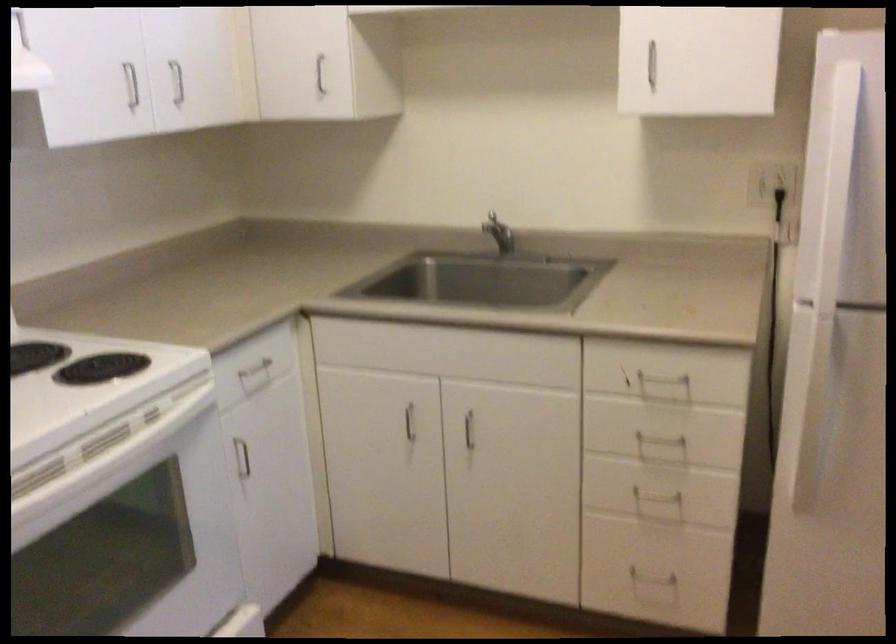
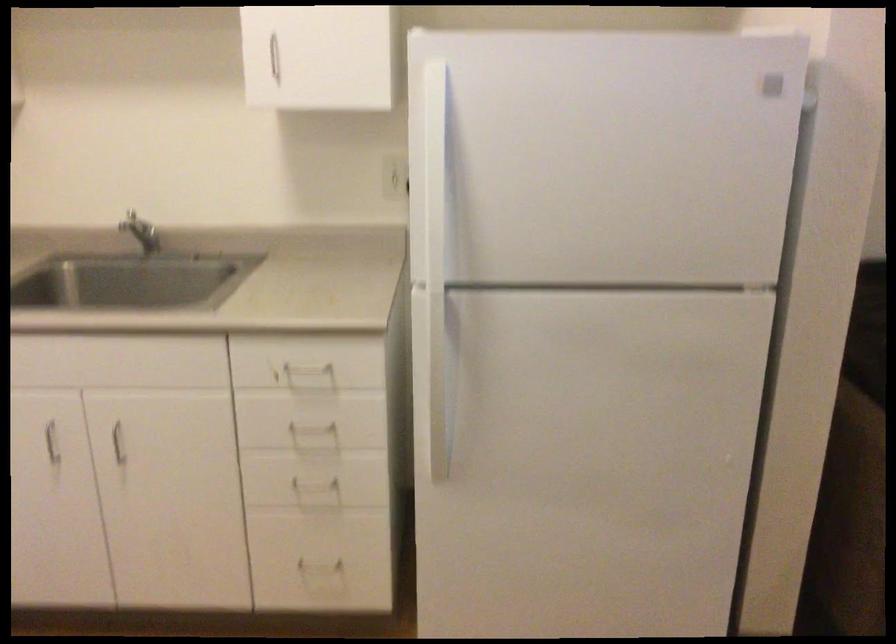
Find the pixel in the second image that matches the point at 467,418 in the first image.

(116, 430)